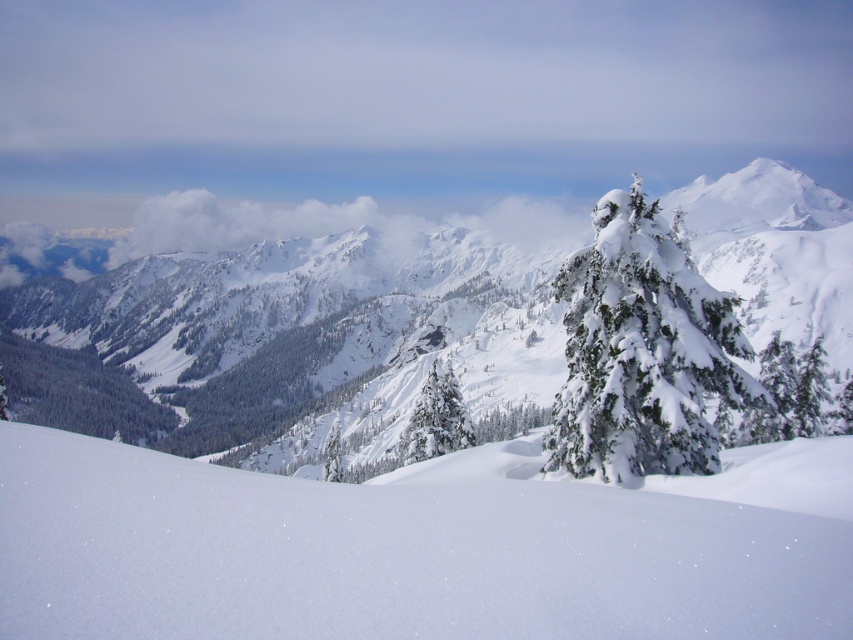
Question: Which point is farther from the camera taking this photo?

Choices:
 (A) (656, 360)
 (B) (126, 388)

Answer: (B)

Question: Which point is closer to the camera?

Choices:
 (A) (144, 560)
 (B) (753, 392)
 (C) (74, 420)
 (D) (413, 408)

Answer: (A)

Question: Which is nearer to the white snow-covered mountain at center?

Choices:
 (A) white snow at center
 (B) green matte tree at center
 (C) green textured evergreen tree at center

Answer: (A)

Question: Does white snow-covered mountain at center lie behind green matte tree at center?

Choices:
 (A) yes
 (B) no

Answer: (B)

Question: Is white snow at center bigger than green textured evergreen tree at center?

Choices:
 (A) no
 (B) yes

Answer: (A)

Question: Does white snow-covered mountain at center appear over green textured evergreen tree at center?

Choices:
 (A) yes
 (B) no

Answer: (A)